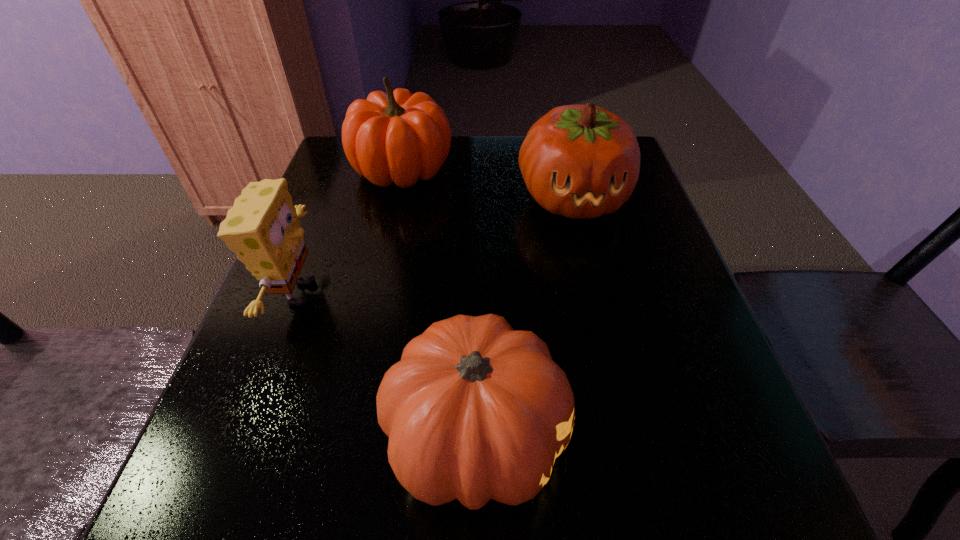
You are a GUI agent. You are given a task and a screenshot of the screen. Output one action in this format:
    pyautogui.click(x=<x>, y=<y>)
    Task: Click on the sponge
    The height and width of the screenshot is (540, 960).
    Given the screenshot: What is the action you would take?
    pyautogui.click(x=262, y=228)

Identify the location of the nearest pumpkin. (474, 410).

I want to click on the shortest pumpkin, so click(474, 410).

You are a GUI agent. You are given a task and a screenshot of the screen. Output one action in this format:
    pyautogui.click(x=<x>, y=<y>)
    Task: Click on the vacant space located 0.210m on the face of the second nearest object
    The image size is (960, 540).
    Given the screenshot: What is the action you would take?
    pyautogui.click(x=435, y=293)

The width and height of the screenshot is (960, 540). I want to click on vacant area situated on the carved face of the nearest pumpkin, so click(719, 437).

This screenshot has width=960, height=540. I want to click on object present at the near edge, so click(x=474, y=410).

Locate an element on the screen. The width and height of the screenshot is (960, 540). pumpkin at the left edge is located at coordinates (398, 137).

Identify the location of sponge at the left edge. The width and height of the screenshot is (960, 540). (262, 228).

Image resolution: width=960 pixels, height=540 pixels. In order to click on object at the right edge in this screenshot , I will do `click(580, 161)`.

You are a GUI agent. You are given a task and a screenshot of the screen. Output one action in this format:
    pyautogui.click(x=<x>, y=<y>)
    Task: Click on the object that is at the far left corner
    This screenshot has height=540, width=960.
    Given the screenshot: What is the action you would take?
    pyautogui.click(x=398, y=137)